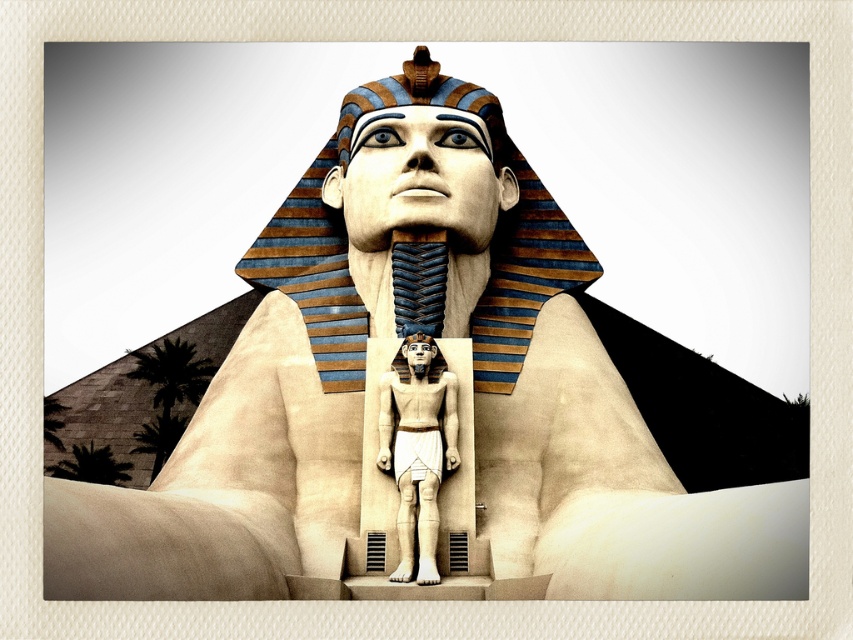
Question: Which object is farther from the camera taking this photo?

Choices:
 (A) white stone statue at center
 (B) matte gold statue at center
 (C) matte gold pharaoh head at center

Answer: (C)

Question: Is matte gold pharaoh head at center to the left of white stone statue at center from the viewer's perspective?

Choices:
 (A) yes
 (B) no

Answer: (B)

Question: Is white stone statue at center bigger than matte gold statue at center?

Choices:
 (A) yes
 (B) no

Answer: (A)

Question: Which point appears closest to the camera in this image?

Choices:
 (A) (386, 188)
 (B) (424, 376)

Answer: (B)

Question: Which object is farther from the camera taking this photo?

Choices:
 (A) white stone statue at center
 (B) matte gold pharaoh head at center
 (C) matte gold statue at center

Answer: (B)

Question: Does white stone statue at center appear under matte gold statue at center?

Choices:
 (A) yes
 (B) no

Answer: (A)